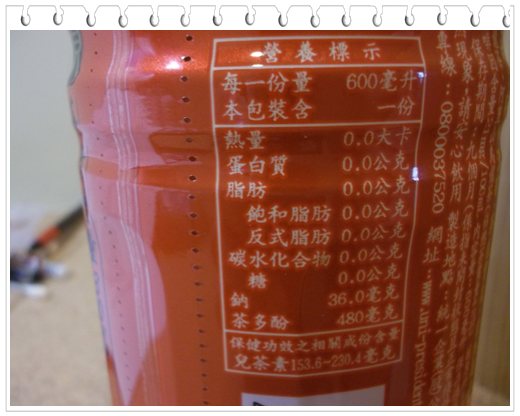
Find the location of a particular element. The image size is (520, 416). image frame is located at coordinates (8, 308), (512, 283).